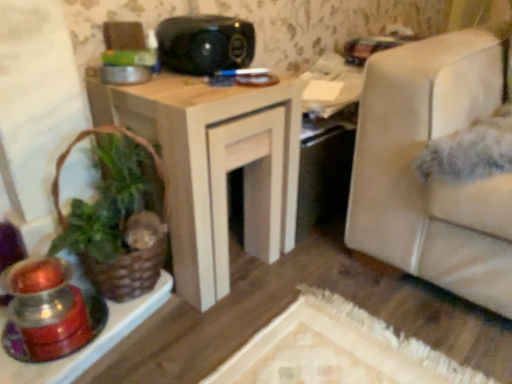
Question: From the image's perspective, is wooden table at center located above brown woven basket at left?

Choices:
 (A) yes
 (B) no

Answer: (A)

Question: Is wooden table at center located outside brown woven basket at left?

Choices:
 (A) no
 (B) yes

Answer: (B)

Question: Is wooden table at center facing towards brown woven basket at left?

Choices:
 (A) no
 (B) yes

Answer: (A)

Question: From a real-world perspective, does wooden table at center sit lower than brown woven basket at left?

Choices:
 (A) no
 (B) yes

Answer: (B)

Question: Is wooden table at center bigger than brown woven basket at left?

Choices:
 (A) no
 (B) yes

Answer: (B)

Question: From a real-world perspective, relative to wooden table at center, is black plastic speaker at upper center vertically above or below?

Choices:
 (A) below
 (B) above

Answer: (B)

Question: Is black plastic speaker at upper center wider or thinner than wooden table at center?

Choices:
 (A) wide
 (B) thin

Answer: (B)

Question: Is black plastic speaker at upper center in front of or behind wooden table at center in the image?

Choices:
 (A) front
 (B) behind

Answer: (B)

Question: Is black plastic speaker at upper center taller or shorter than wooden table at center?

Choices:
 (A) tall
 (B) short

Answer: (B)

Question: In the image, is brown woven basket at left positioned in front of or behind black plastic speaker at upper center?

Choices:
 (A) front
 (B) behind

Answer: (A)

Question: Is brown woven basket at left inside the boundaries of black plastic speaker at upper center, or outside?

Choices:
 (A) outside
 (B) inside

Answer: (A)

Question: In terms of width, does brown woven basket at left look wider or thinner when compared to black plastic speaker at upper center?

Choices:
 (A) wide
 (B) thin

Answer: (B)

Question: Is brown woven basket at left taller or shorter than black plastic speaker at upper center?

Choices:
 (A) short
 (B) tall

Answer: (B)

Question: Would you say black plastic speaker at upper center is inside or outside brown woven basket at left?

Choices:
 (A) inside
 (B) outside

Answer: (B)

Question: From the image's perspective, is black plastic speaker at upper center positioned above or below brown woven basket at left?

Choices:
 (A) below
 (B) above

Answer: (B)